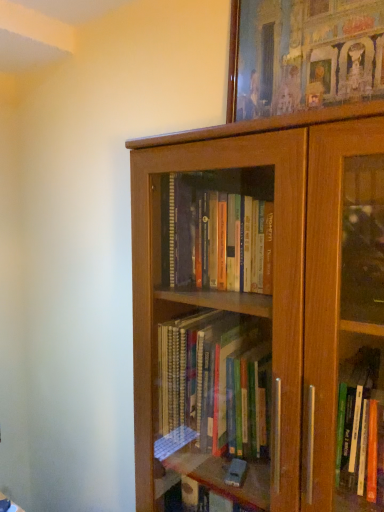
Question: From the image's perspective, relative to wooden picture frame at upper center, is brown wood bookcase at center above or below?

Choices:
 (A) below
 (B) above

Answer: (A)

Question: Visually, is brown wood bookcase at center positioned to the left or to the right of wooden picture frame at upper center?

Choices:
 (A) left
 (B) right

Answer: (A)

Question: Is point (319, 295) positioned closer to the camera than point (276, 18)?

Choices:
 (A) farther
 (B) closer

Answer: (B)

Question: Do you think wooden picture frame at upper center is within brown wood bookcase at center, or outside of it?

Choices:
 (A) inside
 (B) outside

Answer: (B)

Question: Is point (274, 11) closer or farther from the camera than point (369, 155)?

Choices:
 (A) farther
 (B) closer

Answer: (A)

Question: From the image's perspective, relative to brown wood bookcase at center, is wooden picture frame at upper center above or below?

Choices:
 (A) below
 (B) above

Answer: (B)

Question: Relative to brown wood bookcase at center, is wooden picture frame at upper center in front or behind?

Choices:
 (A) behind
 (B) front

Answer: (A)